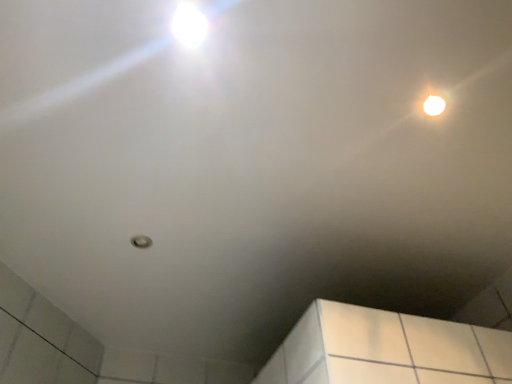
Measure the distance between white glossy droplight at upper right, the 1th droplight in the right-to-left sequence, and camera.

1.13 meters.

Image resolution: width=512 pixels, height=384 pixels. In order to click on white glossy droplight at upper right, arranged as the 2th droplight when viewed from the top in this screenshot , I will do `click(434, 105)`.

How much space does white glossy droplight at upper right, the 1th droplight in the right-to-left sequence, occupy vertically?

The height of white glossy droplight at upper right, the 1th droplight in the right-to-left sequence, is 0.44 inches.

The width and height of the screenshot is (512, 384). Describe the element at coordinates (434, 105) in the screenshot. I see `white glossy droplight at upper right, arranged as the 2th droplight when viewed from the top` at that location.

This screenshot has height=384, width=512. What do you see at coordinates (189, 25) in the screenshot?
I see `white glossy droplight at upper left, arranged as the 1th droplight when viewed from the top` at bounding box center [189, 25].

At what (x,y) coordinates should I click in order to perform the action: click on white glossy droplight at upper left, which appears as the 2th droplight when ordered from the bottom. Please return your answer as a coordinate pair (x, y). Image resolution: width=512 pixels, height=384 pixels. Looking at the image, I should click on (189, 25).

Identify the location of white glossy droplight at upper right, marked as the first droplight in a bottom-to-top arrangement. (434, 105).

Based on the photo, can you confirm if white glossy droplight at upper left, the 1th droplight viewed from the front, is positioned to the right of white glossy droplight at upper right, the 1th droplight in the right-to-left sequence?

In fact, white glossy droplight at upper left, the 1th droplight viewed from the front, is to the left of white glossy droplight at upper right, the 1th droplight in the right-to-left sequence.

Which object is closer to the camera taking this photo, white glossy droplight at upper left, placed as the second droplight when sorted from back to front, or white glossy droplight at upper right, acting as the 2th droplight starting from the front?

white glossy droplight at upper left, placed as the second droplight when sorted from back to front, is closer to the camera.

Which point is more forward, [178,6] or [428,110]?

The point [178,6] is closer to the camera.

From the image's perspective, who appears lower, white glossy droplight at upper left, placed as the second droplight when sorted from back to front, or white glossy droplight at upper right, acting as the 2th droplight starting from the front?

From the image's view, white glossy droplight at upper right, acting as the 2th droplight starting from the front, is below.

From a real-world perspective, is white glossy droplight at upper left, arranged as the first droplight when viewed from the left, physically located above or below white glossy droplight at upper right, the second droplight viewed from the left?

Clearly, from a real-world perspective, white glossy droplight at upper left, arranged as the first droplight when viewed from the left, is below white glossy droplight at upper right, the second droplight viewed from the left.

Considering the sizes of objects white glossy droplight at upper left, placed as the second droplight when sorted from back to front, and white glossy droplight at upper right, acting as the 2th droplight starting from the front, in the image provided, who is thinner, white glossy droplight at upper left, placed as the second droplight when sorted from back to front, or white glossy droplight at upper right, acting as the 2th droplight starting from the front,?

white glossy droplight at upper right, acting as the 2th droplight starting from the front.

Considering the sizes of white glossy droplight at upper left, placed as the second droplight when sorted from back to front, and white glossy droplight at upper right, acting as the 2th droplight starting from the front, in the image, is white glossy droplight at upper left, placed as the second droplight when sorted from back to front, taller or shorter than white glossy droplight at upper right, acting as the 2th droplight starting from the front,?

In the image, white glossy droplight at upper left, placed as the second droplight when sorted from back to front, appears to be shorter than white glossy droplight at upper right, acting as the 2th droplight starting from the front.

Does white glossy droplight at upper left, arranged as the 1th droplight when viewed from the top, have a larger size compared to white glossy droplight at upper right, marked as the 1th droplight in a back-to-front arrangement?

No.

Based on the photo, is white glossy droplight at upper left, positioned as the 2th droplight in right-to-left order, not within white glossy droplight at upper right, marked as the first droplight in a bottom-to-top arrangement?

white glossy droplight at upper left, positioned as the 2th droplight in right-to-left order, is positioned outside white glossy droplight at upper right, marked as the first droplight in a bottom-to-top arrangement.

Would you consider white glossy droplight at upper left, the 1th droplight viewed from the front, to be distant from white glossy droplight at upper right, the second droplight viewed from the left?

That's not correct — white glossy droplight at upper left, the 1th droplight viewed from the front, is a little close to white glossy droplight at upper right, the second droplight viewed from the left.

Does white glossy droplight at upper left, the 1th droplight viewed from the front, turn towards white glossy droplight at upper right, acting as the 2th droplight starting from the front?

Yes, white glossy droplight at upper left, the 1th droplight viewed from the front, is turned towards white glossy droplight at upper right, acting as the 2th droplight starting from the front.

Based on the photo, how distant is white glossy droplight at upper left, positioned as the 2th droplight in right-to-left order, from white glossy droplight at upper right, marked as the 1th droplight in a back-to-front arrangement?

white glossy droplight at upper left, positioned as the 2th droplight in right-to-left order, and white glossy droplight at upper right, marked as the 1th droplight in a back-to-front arrangement, are 25.42 inches apart from each other.

The image size is (512, 384). I want to click on droplight that appears on the right of white glossy droplight at upper left, arranged as the 1th droplight when viewed from the top, so click(x=434, y=105).

Can you confirm if white glossy droplight at upper right, marked as the 1th droplight in a back-to-front arrangement, is positioned to the left of white glossy droplight at upper left, positioned as the 2th droplight in right-to-left order?

No, white glossy droplight at upper right, marked as the 1th droplight in a back-to-front arrangement, is not to the left of white glossy droplight at upper left, positioned as the 2th droplight in right-to-left order.

Considering the positions of objects white glossy droplight at upper right, arranged as the 2th droplight when viewed from the top, and white glossy droplight at upper left, positioned as the 2th droplight in right-to-left order, in the image provided, who is in front, white glossy droplight at upper right, arranged as the 2th droplight when viewed from the top, or white glossy droplight at upper left, positioned as the 2th droplight in right-to-left order,?

white glossy droplight at upper left, positioned as the 2th droplight in right-to-left order, is closer to the camera.

Does point (434, 97) lie behind point (199, 36)?

Yes, it is behind point (199, 36).

From the image's perspective, is white glossy droplight at upper right, marked as the 1th droplight in a back-to-front arrangement, positioned above or below white glossy droplight at upper left, the 1th droplight viewed from the front?

Clearly, from the image's perspective, white glossy droplight at upper right, marked as the 1th droplight in a back-to-front arrangement, is below white glossy droplight at upper left, the 1th droplight viewed from the front.

Looking at this image, from a real-world perspective, is white glossy droplight at upper right, arranged as the 2th droplight when viewed from the top, over white glossy droplight at upper left, positioned as the 2th droplight in right-to-left order?

Yes, from a real-world perspective, white glossy droplight at upper right, arranged as the 2th droplight when viewed from the top, is on top of white glossy droplight at upper left, positioned as the 2th droplight in right-to-left order.

Consider the image. Considering the sizes of white glossy droplight at upper right, marked as the first droplight in a bottom-to-top arrangement, and white glossy droplight at upper left, placed as the second droplight when sorted from back to front, in the image, is white glossy droplight at upper right, marked as the first droplight in a bottom-to-top arrangement, wider or thinner than white glossy droplight at upper left, placed as the second droplight when sorted from back to front,?

In the image, white glossy droplight at upper right, marked as the first droplight in a bottom-to-top arrangement, appears to be more narrow than white glossy droplight at upper left, placed as the second droplight when sorted from back to front.

Is white glossy droplight at upper right, the 1th droplight in the right-to-left sequence, taller or shorter than white glossy droplight at upper left, arranged as the 1th droplight when viewed from the top?

Considering their sizes, white glossy droplight at upper right, the 1th droplight in the right-to-left sequence, has more height than white glossy droplight at upper left, arranged as the 1th droplight when viewed from the top.

Who is bigger, white glossy droplight at upper right, marked as the 1th droplight in a back-to-front arrangement, or white glossy droplight at upper left, placed as the second droplight when sorted from back to front?

white glossy droplight at upper right, marked as the 1th droplight in a back-to-front arrangement.

Do you think white glossy droplight at upper right, the second droplight viewed from the left, is within white glossy droplight at upper left, positioned as the 2th droplight in right-to-left order, or outside of it?

white glossy droplight at upper right, the second droplight viewed from the left, is outside white glossy droplight at upper left, positioned as the 2th droplight in right-to-left order.

Would you say white glossy droplight at upper right, marked as the 1th droplight in a back-to-front arrangement, is a long distance from white glossy droplight at upper left, arranged as the 1th droplight when viewed from the top?

white glossy droplight at upper right, marked as the 1th droplight in a back-to-front arrangement, is near white glossy droplight at upper left, arranged as the 1th droplight when viewed from the top, not far away.

Is white glossy droplight at upper right, acting as the 2th droplight starting from the front, positioned with its back to white glossy droplight at upper left, positioned as the 2th droplight in right-to-left order?

No, white glossy droplight at upper right, acting as the 2th droplight starting from the front, is not facing the opposite direction of white glossy droplight at upper left, positioned as the 2th droplight in right-to-left order.

Locate an element on the screen. Image resolution: width=512 pixels, height=384 pixels. droplight on the left of white glossy droplight at upper right, the second droplight viewed from the left is located at coordinates (189, 25).

Identify the location of droplight on the left of white glossy droplight at upper right, marked as the 1th droplight in a back-to-front arrangement. (189, 25).

Find the location of a particular element. The height and width of the screenshot is (384, 512). droplight above the white glossy droplight at upper right, the second droplight viewed from the left (from the image's perspective) is located at coordinates (189, 25).